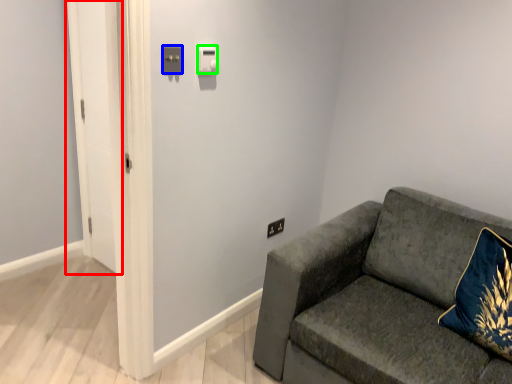
Question: Based on their relative distances, which object is farther from glass door (highlighted by a red box)? Choose from light switch (highlighted by a blue box) and light switch (highlighted by a green box).

Choices:
 (A) light switch
 (B) light switch

Answer: (A)